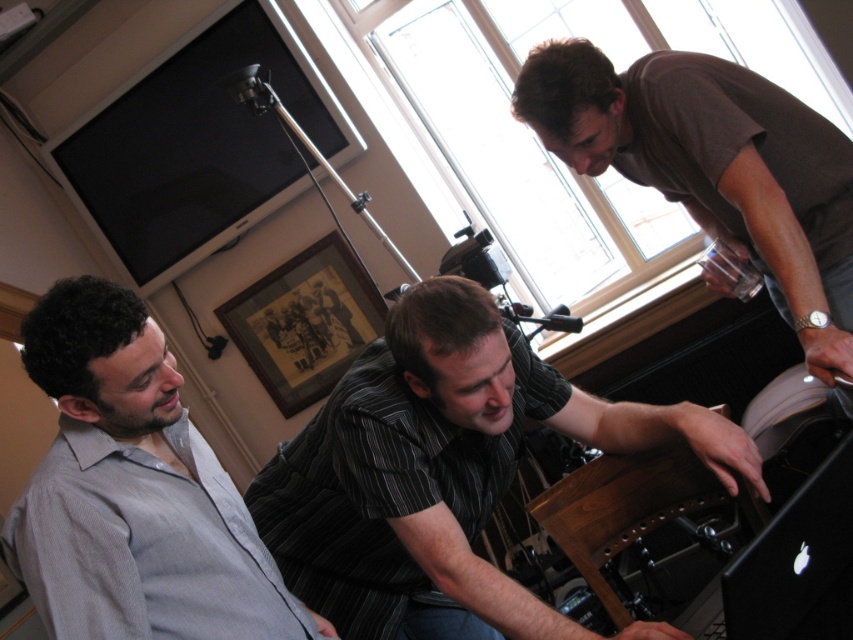
Based on the scene description, which object has a greater height between the striped cotton shirt at center and the gray striped shirt at left?

The striped cotton shirt at center has a greater height compared to the gray striped shirt at left.

Based on the coordinates provided, which object is located at point (x=134, y=492)?

The point (x=134, y=492) corresponds to the gray striped shirt at left.